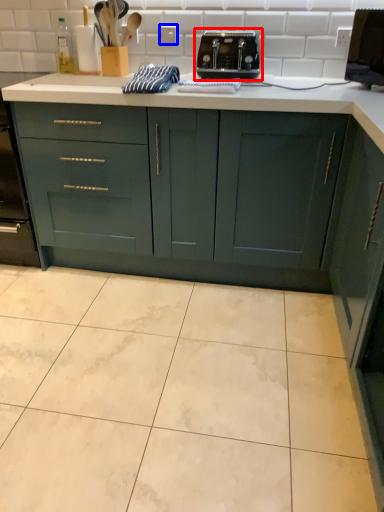
Question: Among these objects, which one is nearest to the camera, toaster (highlighted by a red box) or electric outlet (highlighted by a blue box)?

Choices:
 (A) toaster
 (B) electric outlet

Answer: (A)